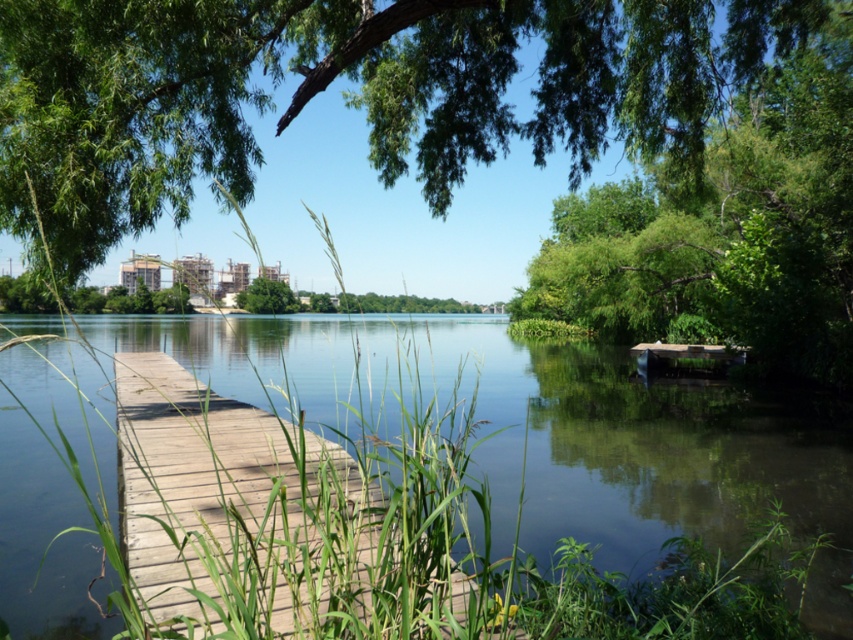
Question: Can you confirm if green leafy tree at upper center is positioned below wooden dock at center?

Choices:
 (A) no
 (B) yes

Answer: (A)

Question: Estimate the real-world distances between objects in this image. Which object is closer to the green leafy tree at right?

Choices:
 (A) clear water at dock center
 (B) green leafy tree at center
 (C) wooden dock at center

Answer: (A)

Question: Does green leafy tree at right appear on the right side of green leafy tree at center?

Choices:
 (A) yes
 (B) no

Answer: (A)

Question: Considering the real-world distances, which object is closest to the green leafy tree at upper center?

Choices:
 (A) clear water at dock center
 (B) wooden dock at center
 (C) green leafy tree at center

Answer: (B)

Question: Which is farther from the green leafy tree at right?

Choices:
 (A) wooden dock at center
 (B) green leafy tree at upper center

Answer: (A)

Question: Does green leafy tree at upper center have a smaller size compared to wooden dock at center?

Choices:
 (A) yes
 (B) no

Answer: (B)